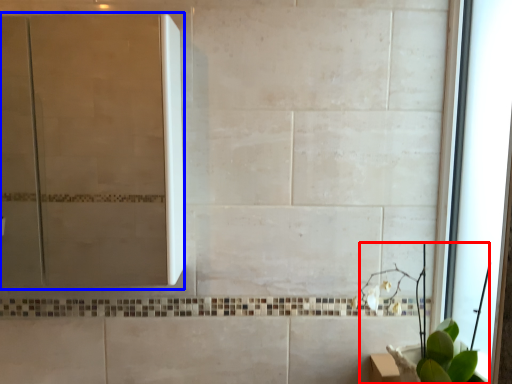
Question: Which object is closer to the camera taking this photo, plant (highlighted by a red box) or screen door (highlighted by a blue box)?

Choices:
 (A) plant
 (B) screen door

Answer: (A)